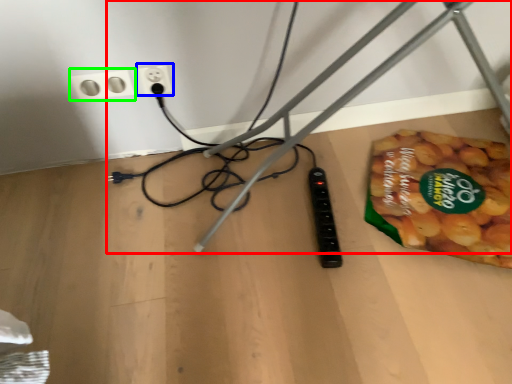
Question: Which object is positioned farthest from wire (highlighted by a red box)? Select from power plugs and sockets (highlighted by a blue box) and power plugs and sockets (highlighted by a green box).

Choices:
 (A) power plugs and sockets
 (B) power plugs and sockets

Answer: (B)